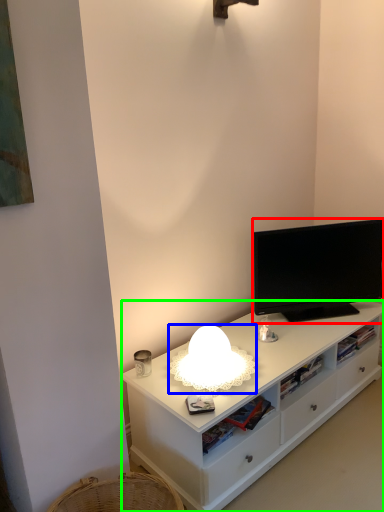
Question: Based on their relative distances, which object is farther from television (highlighted by a red box)? Choose from lamp (highlighted by a blue box) and cabinetry (highlighted by a green box).

Choices:
 (A) lamp
 (B) cabinetry

Answer: (A)